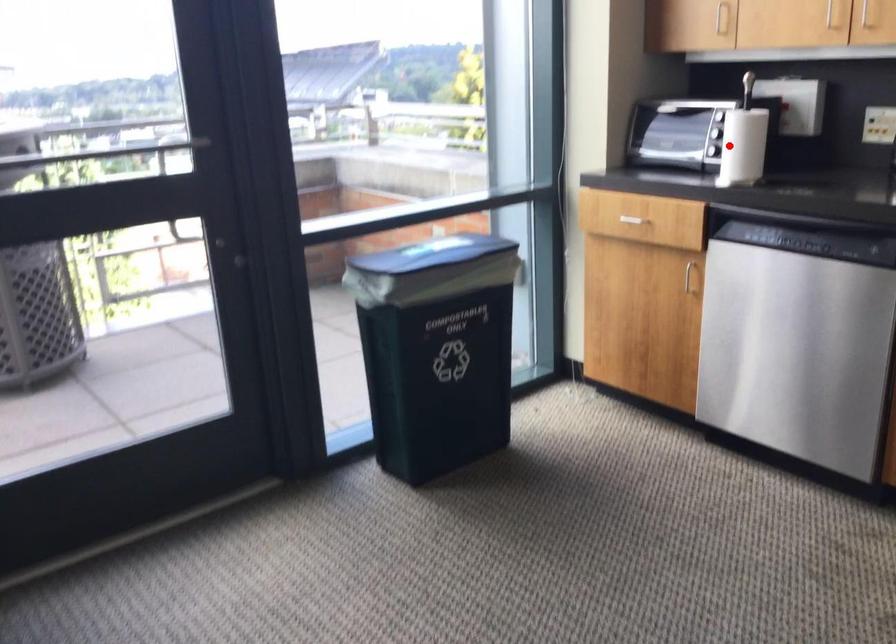
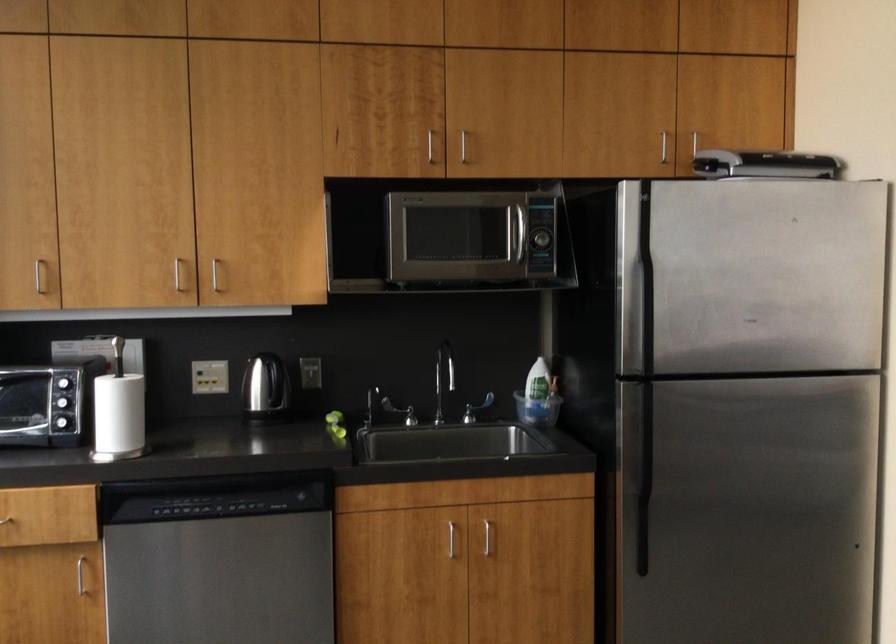
Question: I am providing you with two images of the same scene from different viewpoints. In image1, a red point is highlighted. Considering the same 3D point in image2, which of the following is correct?

Choices:
 (A) It is closer
 (B) It is farther

Answer: (A)